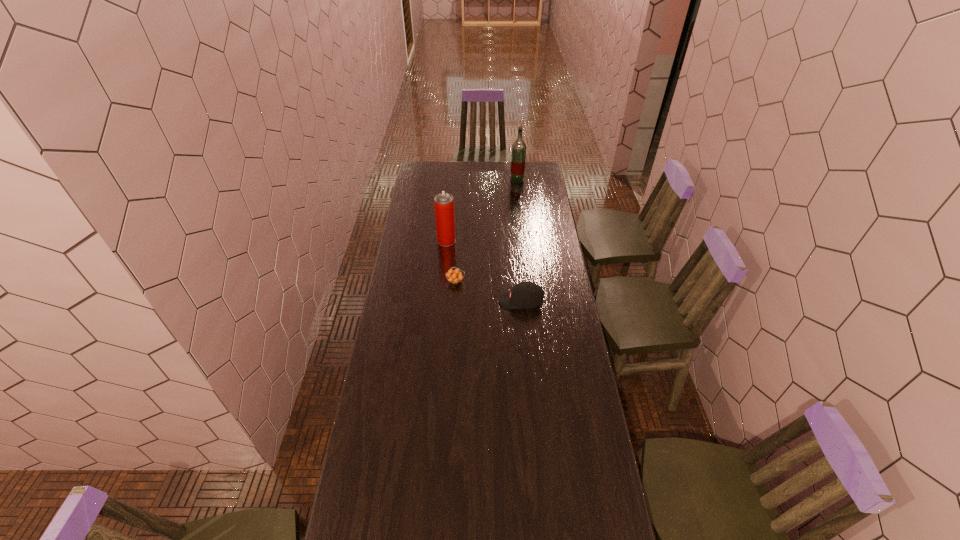
You are a GUI agent. You are given a task and a screenshot of the screen. Output one action in this format:
    pyautogui.click(x=<x>, y=<y>)
    Task: Click on the vacant space located with a logo on the front of the baseball cap
    The image size is (960, 540).
    Given the screenshot: What is the action you would take?
    pyautogui.click(x=454, y=301)

This screenshot has height=540, width=960. In order to click on vacant area situated 0.190m with a logo on the front of the baseball cap in this screenshot , I will do `click(458, 301)`.

This screenshot has width=960, height=540. What are the coordinates of `vacant space located 0.110m on the left of the shortest object` in the screenshot? It's located at (423, 282).

Find the location of a particular element. object that is at the far edge is located at coordinates (519, 147).

The image size is (960, 540). I want to click on liquor located at the right edge, so (x=519, y=147).

Find the location of a particular element. This screenshot has height=540, width=960. baseball cap present at the right edge is located at coordinates (525, 295).

Identify the location of object located at the far right corner. (519, 147).

In the image, there is a desktop. Where is `free space at the far edge`? free space at the far edge is located at coordinates (472, 171).

Image resolution: width=960 pixels, height=540 pixels. In the image, there is a desktop. What are the coordinates of `vacant space at the left edge` in the screenshot? It's located at (408, 241).

In the image, there is a desktop. Where is `vacant space at the right edge`? This screenshot has width=960, height=540. vacant space at the right edge is located at coordinates (590, 408).